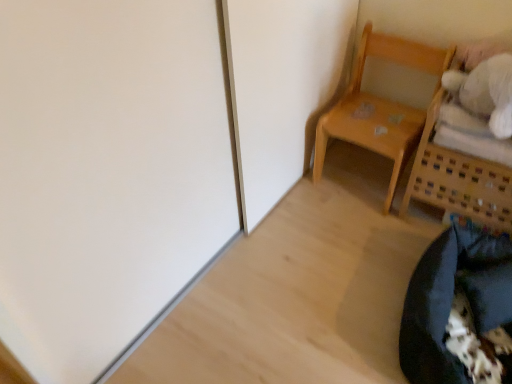
Question: Is wooden basket at upper right, the 2th furniture positioned from the left, looking in the opposite direction of black fabric bean bag chair at lower right?

Choices:
 (A) no
 (B) yes

Answer: (A)

Question: Is wooden basket at upper right, the 2th furniture positioned from the left, bigger than black fabric bean bag chair at lower right?

Choices:
 (A) no
 (B) yes

Answer: (B)

Question: Would you say wooden basket at upper right, which is counted as the 1th furniture, starting from the right, contains black fabric bean bag chair at lower right?

Choices:
 (A) no
 (B) yes

Answer: (A)

Question: From the image's perspective, is wooden basket at upper right, the 2th furniture positioned from the left, above black fabric bean bag chair at lower right?

Choices:
 (A) no
 (B) yes

Answer: (B)

Question: Is wooden basket at upper right, which is counted as the 1th furniture, starting from the right, wider than black fabric bean bag chair at lower right?

Choices:
 (A) no
 (B) yes

Answer: (A)

Question: Is wooden basket at upper right, the 2th furniture positioned from the left, not within black fabric bean bag chair at lower right?

Choices:
 (A) yes
 (B) no

Answer: (A)

Question: Is black fabric bean bag chair at lower right further to camera compared to light wood chair at upper right, the first furniture when ordered from left to right?

Choices:
 (A) yes
 (B) no

Answer: (B)

Question: Is black fabric bean bag chair at lower right positioned beyond the bounds of light wood chair at upper right, the first furniture when ordered from left to right?

Choices:
 (A) no
 (B) yes

Answer: (B)

Question: From a real-world perspective, is black fabric bean bag chair at lower right under light wood chair at upper right, the first furniture when ordered from left to right?

Choices:
 (A) no
 (B) yes

Answer: (B)

Question: Is light wood chair at upper right, the first furniture when ordered from left to right, at the back of black fabric bean bag chair at lower right?

Choices:
 (A) yes
 (B) no

Answer: (B)

Question: Considering the relative positions of black fabric bean bag chair at lower right and light wood chair at upper right, the first furniture when ordered from left to right, in the image provided, is black fabric bean bag chair at lower right in front of light wood chair at upper right, the first furniture when ordered from left to right,?

Choices:
 (A) no
 (B) yes

Answer: (B)

Question: Considering the relative sizes of black fabric bean bag chair at lower right and light wood chair at upper right, which is the second furniture in right-to-left order, in the image provided, is black fabric bean bag chair at lower right smaller than light wood chair at upper right, which is the second furniture in right-to-left order,?

Choices:
 (A) yes
 (B) no

Answer: (A)

Question: From the image's perspective, is light wood chair at upper right, which is the second furniture in right-to-left order, located above wooden basket at upper right, the 2th furniture positioned from the left?

Choices:
 (A) no
 (B) yes

Answer: (B)